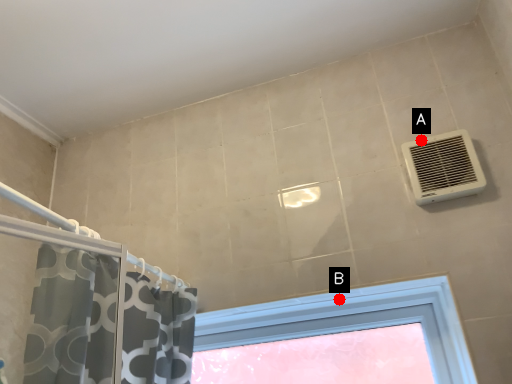
Question: Two points are circled on the image, labeled by A and B beside each circle. Among these points, which one is nearest to the camera?

Choices:
 (A) A is closer
 (B) B is closer

Answer: (B)